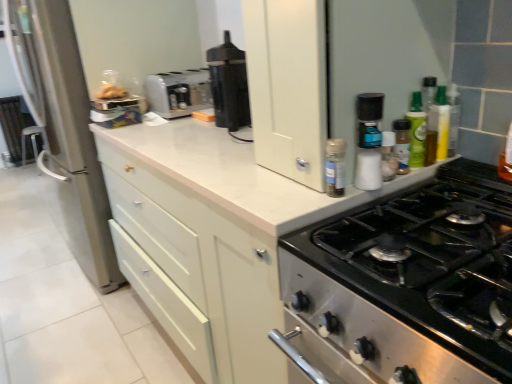
Describe the element at coordinates (402, 144) in the screenshot. I see `translucent plastic spice jar at upper right, arranged as the 3th bottle when viewed from the left` at that location.

What is the approximate height of white plastic salt shaker at upper right, the 4th bottle when ordered from right to left?

It is 4.19 inches.

Where is `white plastic toaster at center`? The height and width of the screenshot is (384, 512). white plastic toaster at center is located at coordinates (178, 92).

Describe the element at coordinates (212, 238) in the screenshot. This screenshot has width=512, height=384. I see `white matte cabinet at upper center` at that location.

Find the location of a particular element. green glass bottle at upper right, acting as the 1th bottle starting from the right is located at coordinates (417, 131).

From a real-world perspective, relative to white plastic spice rack at upper right, is translucent plastic spice jar at upper right, arranged as the 3th bottle when viewed from the left, vertically above or below?

Clearly, from a real-world perspective, translucent plastic spice jar at upper right, arranged as the 3th bottle when viewed from the left, is below white plastic spice rack at upper right.

In the scene shown: Considering the positions of objects translucent plastic spice jar at upper right, arranged as the 3th bottle when viewed from the left, and white plastic spice rack at upper right in the image provided, who is behind, translucent plastic spice jar at upper right, arranged as the 3th bottle when viewed from the left, or white plastic spice rack at upper right?

translucent plastic spice jar at upper right, arranged as the 3th bottle when viewed from the left, is further away from the camera.

From the image's perspective, which is below, translucent plastic spice jar at upper right, arranged as the 3th bottle when viewed from the left, or white plastic spice rack at upper right?

From the image's view, translucent plastic spice jar at upper right, arranged as the 3th bottle when viewed from the left, is below.

In terms of height, does translucent plastic spice jar at upper right, arranged as the 3th bottle when viewed from the left, look taller or shorter compared to white plastic spice rack at upper right?

translucent plastic spice jar at upper right, arranged as the 3th bottle when viewed from the left, is shorter than white plastic spice rack at upper right.

Between translucent plastic spice jar at upper right, which ranks as the second bottle in right-to-left order, and white plastic toaster at center, which one appears on the left side from the viewer's perspective?

From the viewer's perspective, white plastic toaster at center appears more on the left side.

Consider the image. Does translucent plastic spice jar at upper right, which ranks as the second bottle in right-to-left order, have a lesser width compared to white plastic toaster at center?

Yes, translucent plastic spice jar at upper right, which ranks as the second bottle in right-to-left order, is thinner than white plastic toaster at center.

Is translucent plastic spice jar at upper right, which ranks as the second bottle in right-to-left order, positioned in front of white plastic toaster at center?

Yes, the depth of translucent plastic spice jar at upper right, which ranks as the second bottle in right-to-left order, is less than that of white plastic toaster at center.

Considering the sizes of objects translucent plastic spice jar at upper right, which ranks as the second bottle in right-to-left order, and white plastic toaster at center in the image provided, who is smaller, translucent plastic spice jar at upper right, which ranks as the second bottle in right-to-left order, or white plastic toaster at center?

translucent plastic spice jar at upper right, which ranks as the second bottle in right-to-left order, is smaller.

Is white plastic salt shaker at upper right, the second bottle from the left, inside the boundaries of black plastic coffee maker at center, or outside?

white plastic salt shaker at upper right, the second bottle from the left, exists outside the volume of black plastic coffee maker at center.

Can you tell me how much white plastic salt shaker at upper right, the second bottle from the left, and black plastic coffee maker at center differ in facing direction?

The facing directions of white plastic salt shaker at upper right, the second bottle from the left, and black plastic coffee maker at center are 89.3 degrees apart.

Does point (386, 174) come farther from viewer compared to point (245, 91)?

No, it is in front of (245, 91).

Is white matte cabinet at upper center not close to translucent plastic spice jar at upper right, arranged as the 3th bottle when viewed from the left?

That's not correct — white matte cabinet at upper center is a little close to translucent plastic spice jar at upper right, arranged as the 3th bottle when viewed from the left.

Does point (248, 247) appear closer or farther from the camera than point (396, 152)?

Point (248, 247) appears to be closer to the viewer than point (396, 152).

From a real-world perspective, is white matte cabinet at upper center physically above translucent plastic spice jar at upper right, arranged as the 3th bottle when viewed from the left?

No, from a real-world perspective, white matte cabinet at upper center is not over translucent plastic spice jar at upper right, arranged as the 3th bottle when viewed from the left

Which of these two, white matte cabinet at upper center or translucent plastic spice jar at upper right, arranged as the 3th bottle when viewed from the left, is smaller?

With smaller size is translucent plastic spice jar at upper right, arranged as the 3th bottle when viewed from the left.

From the image's perspective, is white plastic salt shaker at upper right, the second bottle from the left, below green glass bottle at upper right, acting as the 1th bottle starting from the right?

Yes, from the image's perspective, white plastic salt shaker at upper right, the second bottle from the left, is below green glass bottle at upper right, acting as the 1th bottle starting from the right.

Is white plastic salt shaker at upper right, positioned as the 3th bottle in right-to-left order, at the left side of green glass bottle at upper right, acting as the 1th bottle starting from the right?

Yes, white plastic salt shaker at upper right, positioned as the 3th bottle in right-to-left order, is to the left of green glass bottle at upper right, acting as the 1th bottle starting from the right.

From a real-world perspective, is white plastic salt shaker at upper right, the second bottle from the left, above or below green glass bottle at upper right, which appears as the 4th bottle when viewed from the left?

From a real-world perspective, white plastic salt shaker at upper right, the second bottle from the left, is physically below green glass bottle at upper right, which appears as the 4th bottle when viewed from the left.

The width and height of the screenshot is (512, 384). Identify the location of the 2nd bottle above when counting from the white plastic salt shaker at upper right, positioned as the 3th bottle in right-to-left order (from the image's perspective). (417, 131).

How many degrees apart are the facing directions of green glass bottle at upper right, acting as the 1th bottle starting from the right, and white plastic toaster at center?

0.072 degrees separate the facing orientations of green glass bottle at upper right, acting as the 1th bottle starting from the right, and white plastic toaster at center.

Image resolution: width=512 pixels, height=384 pixels. Identify the location of the 1st bottle in front of the white plastic toaster at center, counting from the anchor's position. (417, 131).

Is green glass bottle at upper right, acting as the 1th bottle starting from the right, positioned beyond the bounds of white plastic toaster at center?

green glass bottle at upper right, acting as the 1th bottle starting from the right, is positioned outside white plastic toaster at center.

Is white plastic salt shaker at upper right, positioned as the 3th bottle in right-to-left order, positioned with its back to translucent plastic spice jar at upper right, which ranks as the second bottle in right-to-left order?

No, translucent plastic spice jar at upper right, which ranks as the second bottle in right-to-left order, is not at the back of white plastic salt shaker at upper right, positioned as the 3th bottle in right-to-left order.

From the image's perspective, between white plastic salt shaker at upper right, positioned as the 3th bottle in right-to-left order, and translucent plastic spice jar at upper right, arranged as the 3th bottle when viewed from the left, which one is located above?

translucent plastic spice jar at upper right, arranged as the 3th bottle when viewed from the left, appears higher in the image.

Is white plastic salt shaker at upper right, the second bottle from the left, taller or shorter than translucent plastic spice jar at upper right, arranged as the 3th bottle when viewed from the left?

white plastic salt shaker at upper right, the second bottle from the left, is shorter than translucent plastic spice jar at upper right, arranged as the 3th bottle when viewed from the left.

Is white plastic salt shaker at upper right, positioned as the 3th bottle in right-to-left order, at the left side of translucent plastic spice jar at upper right, which ranks as the second bottle in right-to-left order?

Yes, white plastic salt shaker at upper right, positioned as the 3th bottle in right-to-left order, is to the left of translucent plastic spice jar at upper right, which ranks as the second bottle in right-to-left order.

What are the coordinates of `the 3rd bottle to the right when counting from the white plastic spice rack at upper right` in the screenshot? It's located at (402, 144).

Identify the location of toaster that appears above the translucent plastic spice jar at upper right, arranged as the 3th bottle when viewed from the left (from the image's perspective). (178, 92).

From the image, which object appears to be farther from black plastic coffee maker at center, white plastic salt shaker at upper right, the second bottle from the left, or green glass bottle at upper right, acting as the 1th bottle starting from the right?

Based on the image, white plastic salt shaker at upper right, the second bottle from the left, appears to be further to black plastic coffee maker at center.

Which object lies nearer to the anchor point matte silver refrigerator at left, white plastic salt shaker at upper right, positioned as the 3th bottle in right-to-left order, or white plastic spice rack at upper right?

white plastic spice rack at upper right is closer to matte silver refrigerator at left.

From the image, which object appears to be farther from white matte cabinet at upper center, green glass bottle at upper right, acting as the 1th bottle starting from the right, or white plastic spice rack at upper right?

green glass bottle at upper right, acting as the 1th bottle starting from the right, is further to white matte cabinet at upper center.

When comparing their distances from white plastic salt shaker at upper right, the second bottle from the left, does white matte cabinet at upper center or white plastic spice rack at upper right seem further?

The object further to white plastic salt shaker at upper right, the second bottle from the left, is white matte cabinet at upper center.

From the picture: Based on their spatial positions, is white plastic spice rack at upper right or white plastic salt shaker at upper right, positioned as the 3th bottle in right-to-left order, further from green glass bottle at upper right, acting as the 1th bottle starting from the right?

The object further to green glass bottle at upper right, acting as the 1th bottle starting from the right, is white plastic spice rack at upper right.

Looking at the image, which one is located closer to white plastic salt shaker at upper right, the 4th bottle when ordered from right to left, white matte cabinet at upper center or green glass bottle at upper right, acting as the 1th bottle starting from the right?

Based on the image, green glass bottle at upper right, acting as the 1th bottle starting from the right, appears to be nearer to white plastic salt shaker at upper right, the 4th bottle when ordered from right to left.

In the scene shown: Estimate the real-world distances between objects in this image. Which object is closer to translucent plastic spice jar at upper right, arranged as the 3th bottle when viewed from the left, white plastic salt shaker at upper right, the second bottle from the left, or white plastic toaster at center?

white plastic salt shaker at upper right, the second bottle from the left, is positioned closer to the anchor translucent plastic spice jar at upper right, arranged as the 3th bottle when viewed from the left.

Estimate the real-world distances between objects in this image. Which object is further from white plastic salt shaker at upper right, the 4th bottle when ordered from right to left, white plastic toaster at center or white plastic salt shaker at upper right, the second bottle from the left?

white plastic toaster at center is positioned further to the anchor white plastic salt shaker at upper right, the 4th bottle when ordered from right to left.

The height and width of the screenshot is (384, 512). I want to click on cabinetry between white plastic spice rack at upper right and black plastic coffee maker at center in the front-back direction, so click(x=212, y=238).

At what (x,y) coordinates should I click in order to perform the action: click on kitchen appliance between white matte cabinet at upper center and matte silver refrigerator at left along the z-axis. Please return your answer as a coordinate pair (x, y). Looking at the image, I should click on (229, 85).

Where is `bottle located between matte silver refrigerator at left and white plastic salt shaker at upper right, positioned as the 3th bottle in right-to-left order, in the left-right direction`? bottle located between matte silver refrigerator at left and white plastic salt shaker at upper right, positioned as the 3th bottle in right-to-left order, in the left-right direction is located at coordinates (368, 157).

Identify the location of kitchen appliance between matte silver refrigerator at left and white plastic salt shaker at upper right, the second bottle from the left, from left to right. pyautogui.click(x=229, y=85).